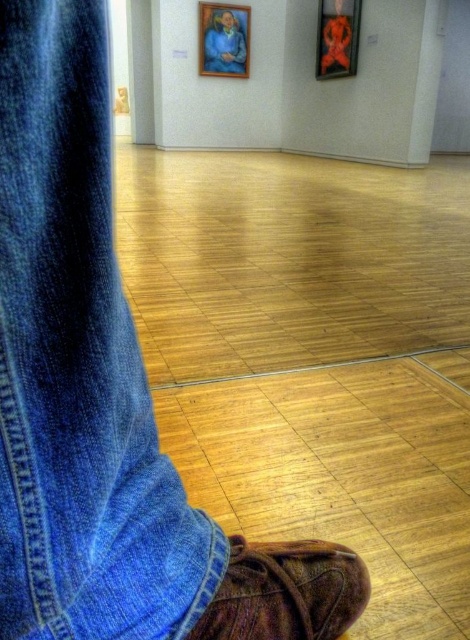
You are an art curator planning to install a new exhibition. You have a narrow display case that can only accommodate objects up to the width of the brown suede shoe at lower right. Can the metallic gold picture frame at upper center fit into this display case?

The brown suede shoe at lower right is thinner than the metallic gold picture frame at upper center, so the metallic gold picture frame at upper center is wider and cannot fit into the display case designed for the shoe.

You are an art installer in the gallery and need to adjust the spacing between the wooden frame at upper center and the metallic gold picture frame at upper center. The museum requires that the distance between these two frames should be exactly 1.2 meters. Based on the current setup, is the spacing between them sufficient or does it need adjustment?

The distance between the wooden frame at upper center and the metallic gold picture frame at upper center is currently 1.40 meters. Since the required distance is 1.2 meters, the frames are spaced further apart than needed. Therefore, they need to be moved closer together to meet the museum requirement.

You are an art curator planning to hang a new painting in the gallery. The new painting requires a space that is 2 meters wide and 3 meters tall. Based on the current layout, is there enough vertical space between the wooden frame at upper center and the ceiling to accommodate the painting?

The wooden frame at upper center is positioned at point (224,38). However, without knowing the exact dimensions of the room or the distance from the frame to the ceiling, it is impossible to determine if there is sufficient vertical space for the new painting.